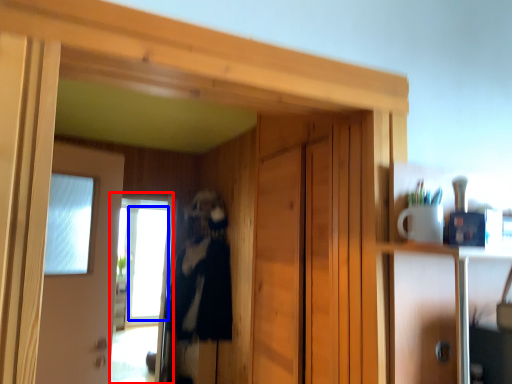
Question: Which of the following is the closest to the observer, screen door (highlighted by a red box) or window (highlighted by a blue box)?

Choices:
 (A) screen door
 (B) window

Answer: (A)